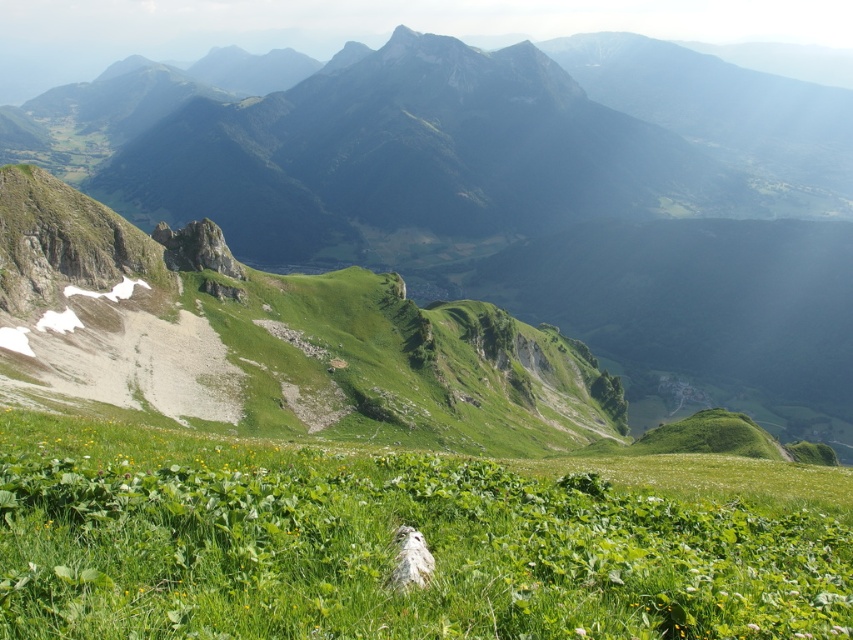
Which is more to the left, green grassy mountain range at center or green leafy grass at center?

Positioned to the left is green grassy mountain range at center.

Consider the image. Measure the distance between green grassy mountain range at center and green leafy grass at center.

The distance of green grassy mountain range at center from green leafy grass at center is 1244.81 feet.

Identify the location of green grassy mountain range at center. (523, 195).